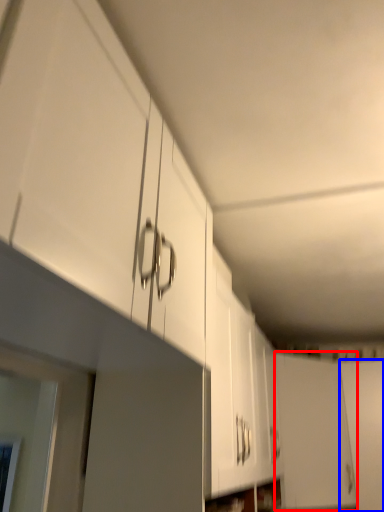
Question: Which of the following is the farthest to the observer, door (highlighted by a red box) or door (highlighted by a blue box)?

Choices:
 (A) door
 (B) door

Answer: (B)